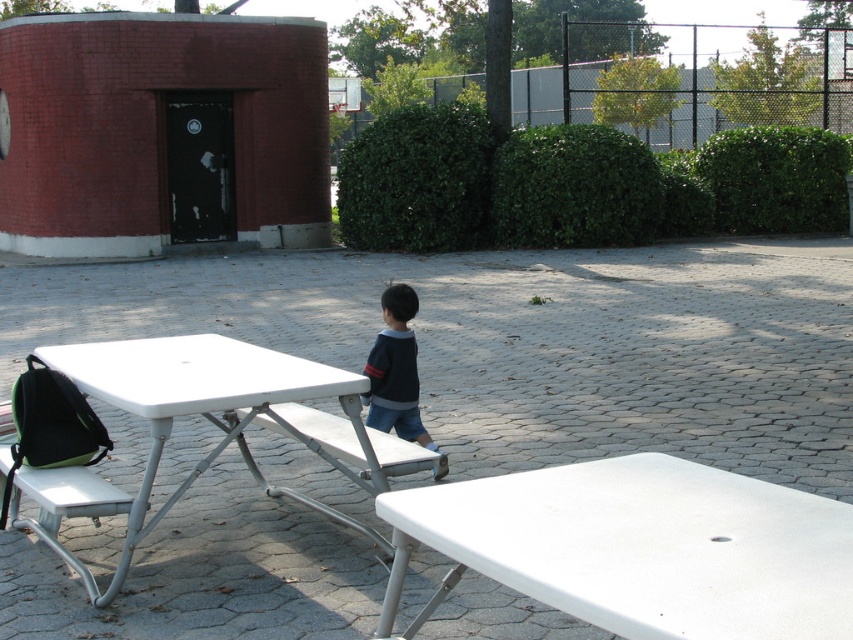
You are planning to place a large umbrella on the white plastic table at lower right. However, there is a white plastic bench at center in the way. Can you place the umbrella on the table without moving the bench?

The white plastic table at lower right is positioned over the white plastic bench at center, so you can place the umbrella on the table without moving the bench because the table is already above the bench and there is no obstruction.

You are standing at the point marked by the coordinates point [637,548] in the image. Looking around, you see the white plastic table at lower right and the brick structure with a dark door. Which direction should you walk to reach the brick structure with a dark door?

Since the point [637,548] marks the white plastic table at lower right, you are already at the table. To reach the brick structure with a dark door, you should walk forward away from the table towards the background where the child is heading.

You are standing at the point labeled point (749, 506) and want to walk to the point labeled point (113, 392). Which direction should you move relative to your current position?

You should move downward and to the left relative to your current position because point (113, 392) is located below and to the left of point (749, 506).